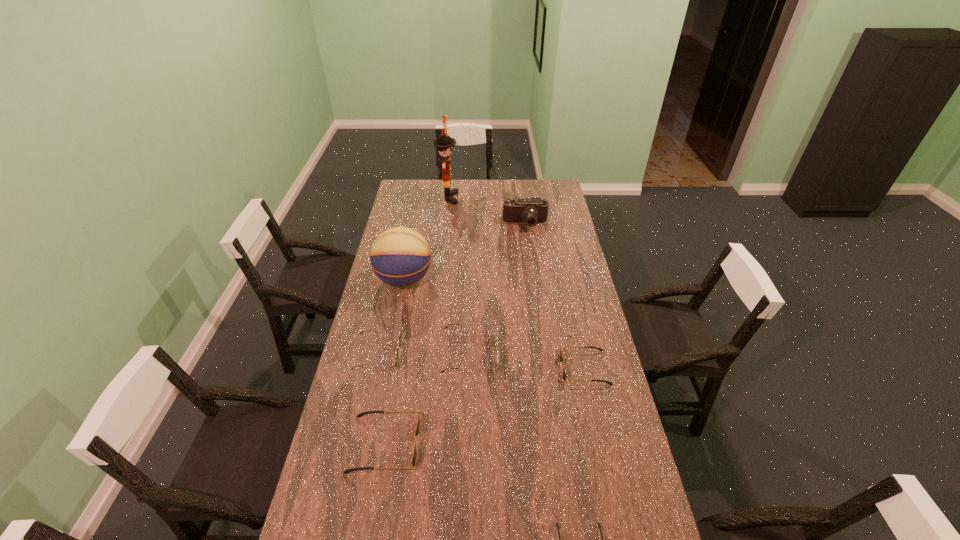
What are the coordinates of `the second smallest black sunglasses` in the screenshot? It's located at (561, 358).

Identify the location of vacant space located 0.170m on the front-facing side of the tallest object. The width and height of the screenshot is (960, 540). (489, 198).

Find the location of `free region located on the patterned surface of the blue basketball`. free region located on the patterned surface of the blue basketball is located at coordinates (454, 280).

Image resolution: width=960 pixels, height=540 pixels. I want to click on free space located on the front-facing side of the eighth nearest object, so click(528, 241).

What are the coordinates of `free region located on the front-facing side of the biggest green sunglasses` in the screenshot? It's located at (595, 353).

At what (x,y) coordinates should I click in order to perform the action: click on vacant area situated 0.200m on the front-facing side of the leftmost black sunglasses. Please return your answer as a coordinate pair (x, y). This screenshot has height=540, width=960. Looking at the image, I should click on click(x=484, y=444).

You are a GUI agent. You are given a task and a screenshot of the screen. Output one action in this format:
    pyautogui.click(x=<x>, y=<y>)
    Task: Click on the free location located 0.100m on the front-facing side of the leftmost green sunglasses
    The image size is (960, 540).
    Given the screenshot: What is the action you would take?
    pyautogui.click(x=427, y=354)

The width and height of the screenshot is (960, 540). I want to click on free region located on the front-facing side of the farthest black sunglasses, so click(463, 368).

The width and height of the screenshot is (960, 540). What are the coordinates of `free space located on the front-facing side of the farthest black sunglasses` in the screenshot? It's located at (544, 368).

You are a GUI agent. You are given a task and a screenshot of the screen. Output one action in this format:
    pyautogui.click(x=<x>, y=<y>)
    Task: Click on the vacant point located 0.140m on the front-facing side of the farthest black sunglasses
    
    Given the screenshot: What is the action you would take?
    pyautogui.click(x=521, y=368)